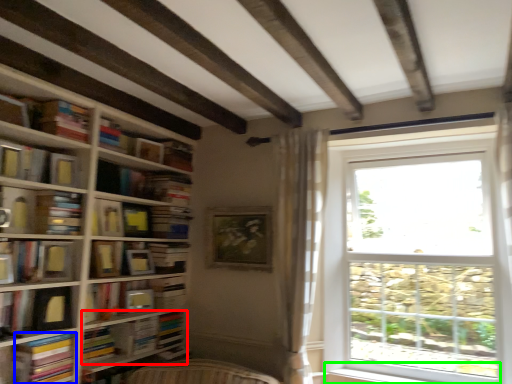
Question: Which object is positioned closest to book (highlighted by a red box)? Select from paperback book (highlighted by a blue box) and window sill (highlighted by a green box).

Choices:
 (A) paperback book
 (B) window sill

Answer: (A)